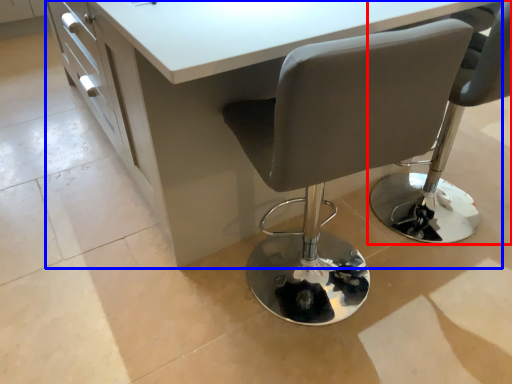
Question: Which point is closer to the camera, chair (highlighted by a red box) or table (highlighted by a blue box)?

Choices:
 (A) chair
 (B) table

Answer: (B)